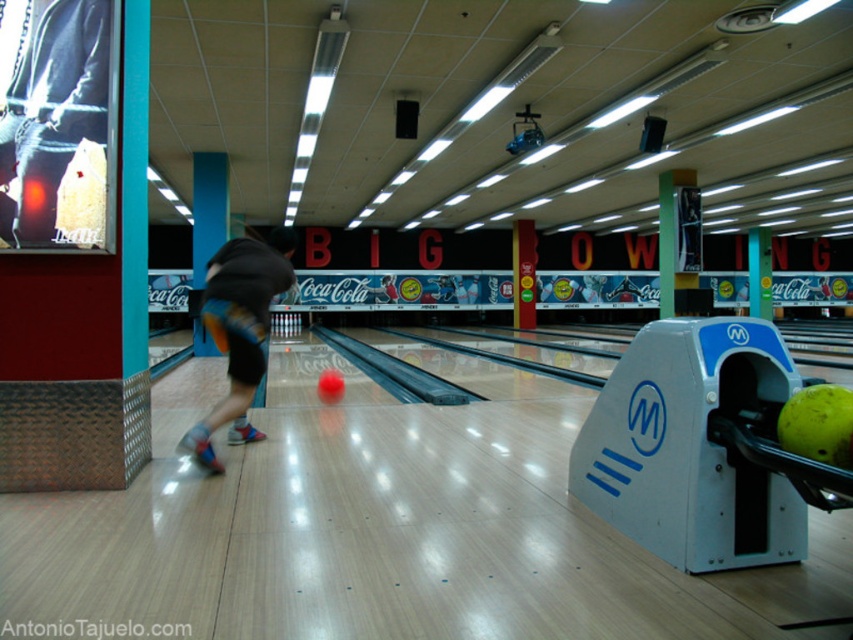
You are a photographer at the bowling alley and want to capture a closeup of the person bowling. Since the denim shorts at center and blue striped shorts at center are both in the frame, which pair of shorts should you zoom in on to ensure they take up more of the photo?

The blue striped shorts at center is larger, so zooming in on it would make it take up more of the photo.

You are a bowler standing at the approach area of the lane. You notice a pair of denim shorts at center located at point (x=57, y=122). If you were to throw a bowling ball towards the pins, would the ball pass in front of or behind the denim shorts at center? Please answer based on their positions.

The denim shorts at center is located at point (x=57, y=122). Since the bowling ball is rolling down the lane towards the pins, the ball would pass in front of the denim shorts at center as it moves toward the pins at the far end of the lane.

You are a photographer trying to capture the exact position of the denim shorts at center in the image. What are the coordinates where you should focus your camera?

The denim shorts at center are located at coordinates point (x=57, y=122).